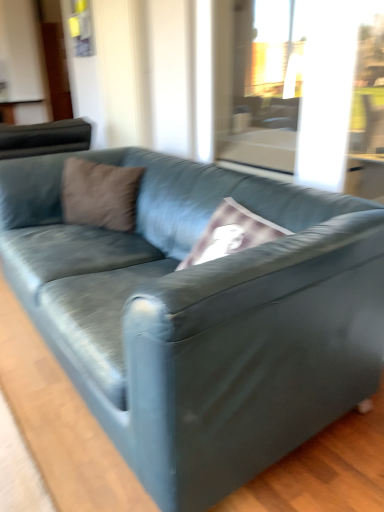
Measure the distance between point [246,255] and camera.

Point [246,255] and camera are 1.03 meters apart.

You are a GUI agent. You are given a task and a screenshot of the screen. Output one action in this format:
    pyautogui.click(x=<x>, y=<y>)
    Task: Click on the suede blue couch at center
    The height and width of the screenshot is (512, 384).
    Given the screenshot: What is the action you would take?
    pyautogui.click(x=201, y=316)

What do you see at coordinates (201, 316) in the screenshot? I see `suede blue couch at center` at bounding box center [201, 316].

Measure the distance between suede blue couch at center and camera.

33.35 inches.

What do you see at coordinates (100, 194) in the screenshot?
I see `brown suede pillow at upper left` at bounding box center [100, 194].

Where is `brown suede pillow at upper left`? This screenshot has width=384, height=512. brown suede pillow at upper left is located at coordinates (100, 194).

What is the approximate height of brown suede pillow at upper left?

brown suede pillow at upper left is 13.54 inches in height.

Where is `suede blue couch at center`? The image size is (384, 512). suede blue couch at center is located at coordinates (201, 316).

From the picture: Can you confirm if brown suede pillow at upper left is positioned to the right of suede blue couch at center?

No.

Considering the relative positions of brown suede pillow at upper left and suede blue couch at center in the image provided, is brown suede pillow at upper left in front of suede blue couch at center?

No.

Is point (99, 218) closer to viewer compared to point (364, 252)?

No.

From the image's perspective, would you say brown suede pillow at upper left is shown under suede blue couch at center?

Actually, brown suede pillow at upper left appears above suede blue couch at center in the image.

From a real-world perspective, does brown suede pillow at upper left sit lower than suede blue couch at center?

Actually, brown suede pillow at upper left is physically above suede blue couch at center in the real world.

Can you confirm if brown suede pillow at upper left is wider than suede blue couch at center?

No, brown suede pillow at upper left is not wider than suede blue couch at center.

Is brown suede pillow at upper left taller or shorter than suede blue couch at center?

In the image, brown suede pillow at upper left appears to be shorter than suede blue couch at center.

Based on their sizes in the image, would you say brown suede pillow at upper left is bigger or smaller than suede blue couch at center?

Considering their sizes, brown suede pillow at upper left takes up less space than suede blue couch at center.

Is suede blue couch at center surrounded by brown suede pillow at upper left?

No, suede blue couch at center is not a part of brown suede pillow at upper left.

Is brown suede pillow at upper left directly adjacent to suede blue couch at center?

No, brown suede pillow at upper left is not with suede blue couch at center.

Is brown suede pillow at upper left facing away from suede blue couch at center?

Absolutely, brown suede pillow at upper left is directed away from suede blue couch at center.

How much distance is there between brown suede pillow at upper left and suede blue couch at center?

brown suede pillow at upper left is 52.71 centimeters from suede blue couch at center.

Locate an element on the screen. This screenshot has height=512, width=384. pillow behind the suede blue couch at center is located at coordinates (100, 194).

Considering the relative positions of suede blue couch at center and brown suede pillow at upper left in the image provided, is suede blue couch at center to the right of brown suede pillow at upper left from the viewer's perspective?

Yes.

Considering the positions of objects suede blue couch at center and brown suede pillow at upper left in the image provided, who is behind, suede blue couch at center or brown suede pillow at upper left?

Positioned behind is brown suede pillow at upper left.

Considering the positions of point (316, 302) and point (108, 225), is point (316, 302) closer or farther from the camera than point (108, 225)?

Clearly, point (316, 302) is closer to the camera than point (108, 225).

From the image's perspective, is suede blue couch at center above brown suede pillow at upper left?

No.

From a real-world perspective, between suede blue couch at center and brown suede pillow at upper left, who is vertically higher?

brown suede pillow at upper left, from a real-world perspective.

Considering the sizes of objects suede blue couch at center and brown suede pillow at upper left in the image provided, who is thinner, suede blue couch at center or brown suede pillow at upper left?

brown suede pillow at upper left is thinner.

Considering the relative sizes of suede blue couch at center and brown suede pillow at upper left in the image provided, is suede blue couch at center taller than brown suede pillow at upper left?

Correct, suede blue couch at center is much taller as brown suede pillow at upper left.

Looking at the image, does suede blue couch at center seem bigger or smaller compared to brown suede pillow at upper left?

In the image, suede blue couch at center appears to be larger than brown suede pillow at upper left.

Is brown suede pillow at upper left located within suede blue couch at center?

Yes, suede blue couch at center is surrounding brown suede pillow at upper left.

Is suede blue couch at center with brown suede pillow at upper left?

No, suede blue couch at center is not touching brown suede pillow at upper left.

Is suede blue couch at center oriented away from brown suede pillow at upper left?

Yes, suede blue couch at center's orientation is away from brown suede pillow at upper left.

How many degrees apart are the facing directions of suede blue couch at center and brown suede pillow at upper left?

There is a 37.1-degree angle between the facing directions of suede blue couch at center and brown suede pillow at upper left.

This screenshot has width=384, height=512. Find the location of `studio couch on the right of the brown suede pillow at upper left`. studio couch on the right of the brown suede pillow at upper left is located at coordinates (201, 316).

Where is `pillow on the left of suede blue couch at center`? pillow on the left of suede blue couch at center is located at coordinates (100, 194).

At what (x,y) coordinates should I click in order to perform the action: click on studio couch in front of the brown suede pillow at upper left. Please return your answer as a coordinate pair (x, y). Looking at the image, I should click on (201, 316).